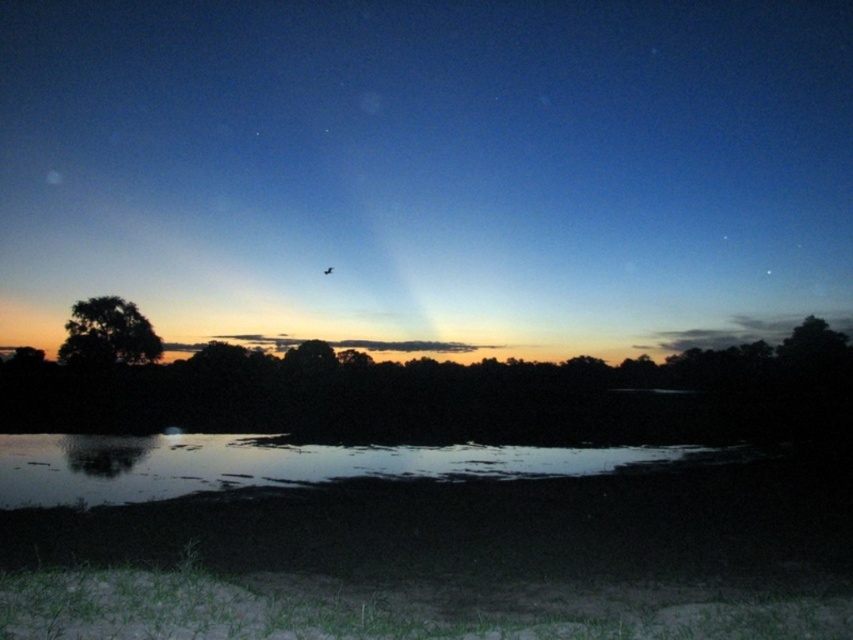
You are standing at the lakeside and want to locate two points marked in the scene. The first point is at coordinates point (670, 458) and the second is at point (115, 323). From your perspective, which point is closer to you?

Point (670, 458) is in front of point (115, 323), so it is closer to you.

You are standing at the edge of the lakeside and want to find the glossy reflective water at center. According to the coordinates provided, where should you look in relation to your position?

The glossy reflective water at center is located at coordinates point (270, 465), which means it is positioned approximately 72.7 percent from the left edge and 31.7 percent from the top edge of the image. From your position at the lakeside edge, you should look towards the lower right direction to locate it.

You are standing at the lakeside and see two points in the image. One is at point (x=643, y=195) and the other is at point (x=67, y=328). Which point is closer to your eyes?

Point (x=643, y=195) is further to the viewer than point (x=67, y=328), so the point closer to your eyes is point (x=67, y=328).